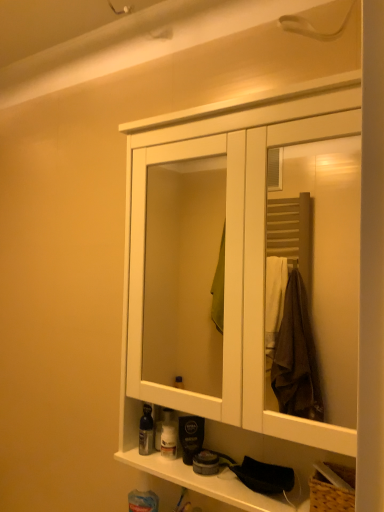
Question: Can you see shiny silver bottle at lower left, positioned as the first toiletry in left-to-right order, touching white wood cabinet at center?

Choices:
 (A) yes
 (B) no

Answer: (B)

Question: Is shiny silver bottle at lower left, positioned as the first toiletry in left-to-right order, smaller than white wood cabinet at center?

Choices:
 (A) no
 (B) yes

Answer: (B)

Question: From a real-world perspective, is shiny silver bottle at lower left, positioned as the first toiletry in left-to-right order, under white wood cabinet at center?

Choices:
 (A) no
 (B) yes

Answer: (B)

Question: Is shiny silver bottle at lower left, acting as the 2th toiletry starting from the right, facing towards white wood cabinet at center?

Choices:
 (A) yes
 (B) no

Answer: (A)

Question: Can you confirm if shiny silver bottle at lower left, positioned as the first toiletry in left-to-right order, is positioned to the left of white wood cabinet at center?

Choices:
 (A) no
 (B) yes

Answer: (B)

Question: Considering their positions, is shiny silver bottle at lower left, positioned as the first toiletry in left-to-right order, located in front of or behind translucent plastic bottle at lower center, the 2th toiletry from the left?

Choices:
 (A) front
 (B) behind

Answer: (A)

Question: From a real-world perspective, is shiny silver bottle at lower left, positioned as the first toiletry in left-to-right order, physically located above or below translucent plastic bottle at lower center, the 2th toiletry from the left?

Choices:
 (A) above
 (B) below

Answer: (A)

Question: Is shiny silver bottle at lower left, positioned as the first toiletry in left-to-right order, wider or thinner than translucent plastic bottle at lower center, which is counted as the 1th toiletry, starting from the right?

Choices:
 (A) wide
 (B) thin

Answer: (A)

Question: From the image's perspective, relative to translucent plastic bottle at lower center, the 2th toiletry from the left, is shiny silver bottle at lower left, acting as the 2th toiletry starting from the right, above or below?

Choices:
 (A) below
 (B) above

Answer: (B)

Question: Is point [380, 71] positioned closer to the camera than point [170, 423]?

Choices:
 (A) closer
 (B) farther

Answer: (A)

Question: From a real-world perspective, is white wood cabinet at center positioned above or below translucent plastic bottle at lower center, which is counted as the 1th toiletry, starting from the right?

Choices:
 (A) below
 (B) above

Answer: (B)

Question: Relative to translucent plastic bottle at lower center, the 2th toiletry from the left, is white wood cabinet at center in front or behind?

Choices:
 (A) behind
 (B) front

Answer: (B)

Question: From the image's perspective, is white wood cabinet at center positioned above or below translucent plastic bottle at lower center, which is counted as the 1th toiletry, starting from the right?

Choices:
 (A) above
 (B) below

Answer: (A)

Question: Considering the positions of translucent plastic bottle at lower center, which is counted as the 1th toiletry, starting from the right, and shiny silver bottle at lower left, acting as the 2th toiletry starting from the right, in the image, is translucent plastic bottle at lower center, which is counted as the 1th toiletry, starting from the right, wider or thinner than shiny silver bottle at lower left, acting as the 2th toiletry starting from the right,?

Choices:
 (A) thin
 (B) wide

Answer: (A)

Question: Is translucent plastic bottle at lower center, which is counted as the 1th toiletry, starting from the right, to the left or to the right of shiny silver bottle at lower left, acting as the 2th toiletry starting from the right, in the image?

Choices:
 (A) right
 (B) left

Answer: (A)